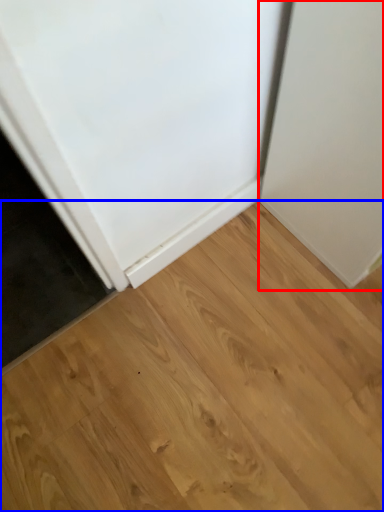
Question: Among these objects, which one is farthest to the camera, door (highlighted by a red box) or hardwood (highlighted by a blue box)?

Choices:
 (A) door
 (B) hardwood

Answer: (B)